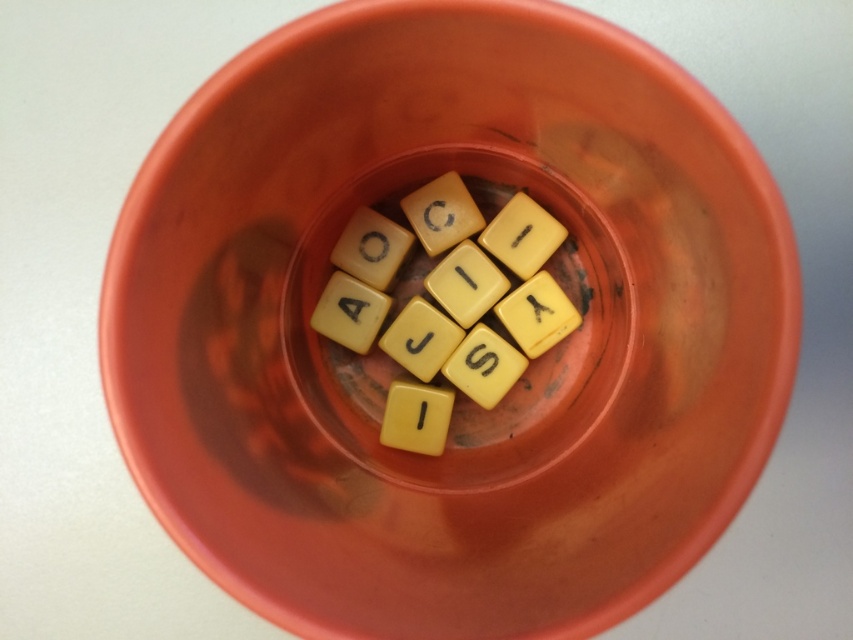
Based on the photo, you are organizing the yellow matte letter tiles at center in the red plastic cup. You want to retrieve the yellow matte letter i at center first. Is it possible to reach it without moving the other tiles?

The yellow matte letter i at center is behind the yellow matte letter tiles at center, so you cannot reach it without moving the other tiles.

You are organizing the yellow matte letter tiles at center and the yellow matte letter i at center in the cup. Which one takes up more vertical space?

The yellow matte letter tiles at center are taller than the yellow matte letter i at center, so they take up more vertical space in the cup.

You are organizing the yellow matte tiles and letters in the cup. Which one is positioned higher up between the yellow matte tile at center and the yellow matte letter at center?

The yellow matte tile at center is located above the yellow matte letter at center.